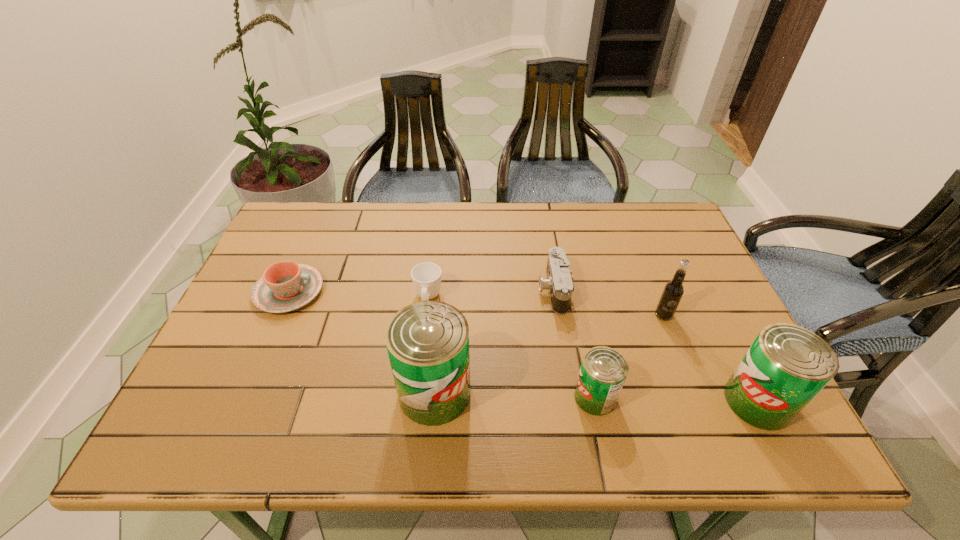
This screenshot has height=540, width=960. I want to click on vacant space that satisfies the following two spatial constraints: 1. with the handle on the side of the cup; 2. on the left side of the shortest can, so click(x=417, y=397).

This screenshot has width=960, height=540. What are the coordinates of `vacant region that satisfies the following two spatial constraints: 1. with the handle on the side of the cup; 2. on the right side of the shortest can` in the screenshot? It's located at (417, 397).